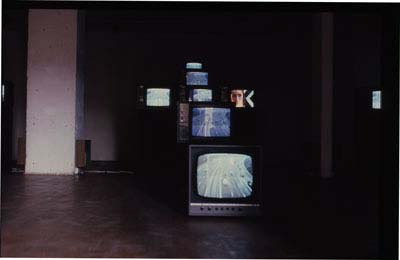
At what (x,y) coordinates should I click in order to perform the action: click on floor. Please return your answer as a coordinate pair (x, y). The image size is (400, 260). Looking at the image, I should click on 107,213.